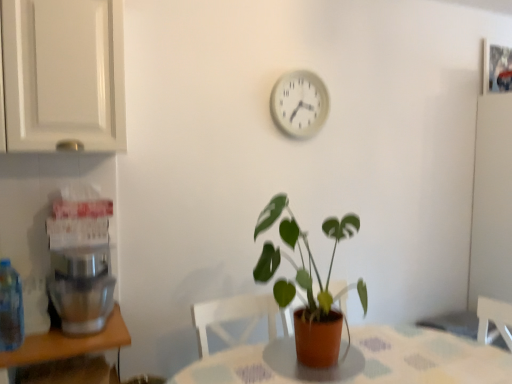
This screenshot has height=384, width=512. Identify the location of vacant space to the right of green matte plant at center. (409, 364).